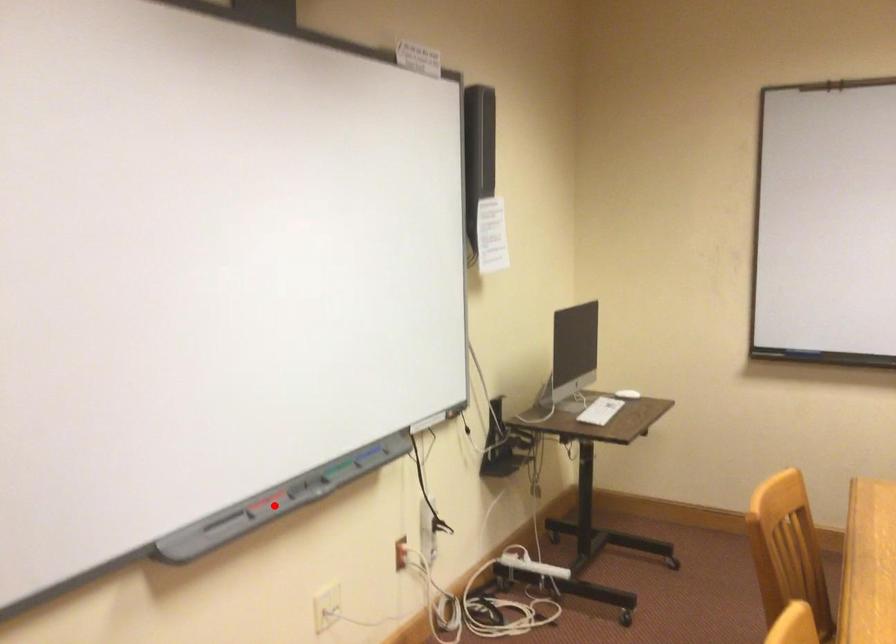
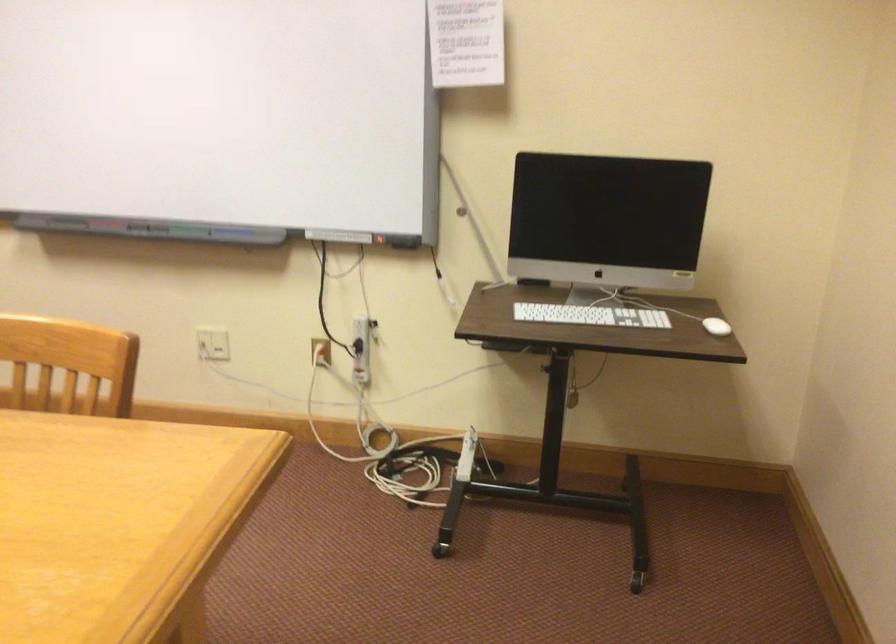
Question: A red point is marked in image1. In image2, is the corresponding 3D point closer to the camera or farther? Reply with the corresponding letter.

Choices:
 (A) The corresponding 3D point is closer.
 (B) The corresponding 3D point is farther.

Answer: (B)